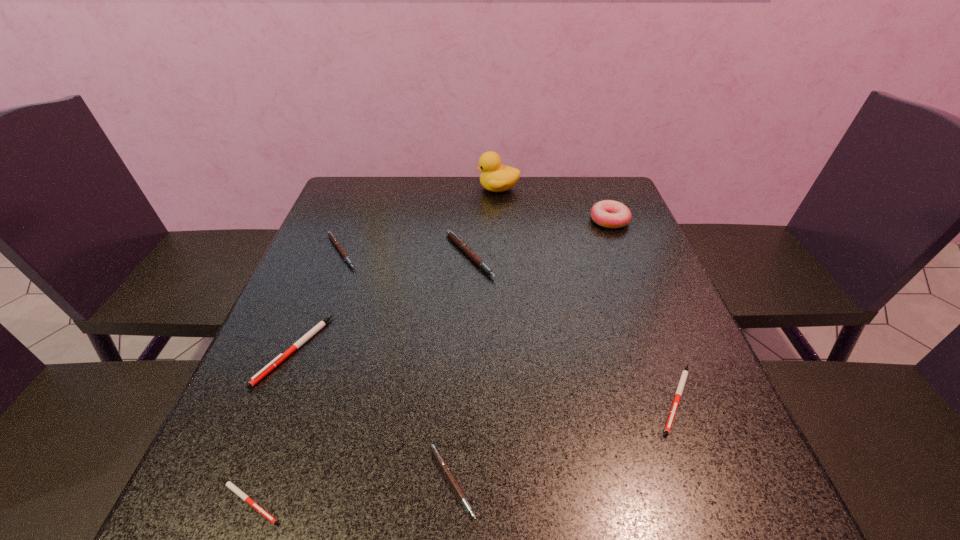
Image resolution: width=960 pixels, height=540 pixels. I want to click on vacant space in between the rightmost white pen and the biggest white pen, so click(x=486, y=374).

Image resolution: width=960 pixels, height=540 pixels. I want to click on free space that is in between the biggest white pen and the leftmost pink pen, so click(318, 301).

The width and height of the screenshot is (960, 540). In order to click on blank region between the seventh shortest object and the tallest object in this screenshot , I will do `click(554, 204)`.

Where is `the sixth closest object to the duck`? the sixth closest object to the duck is located at coordinates (439, 458).

Locate which object ranks sixth in proximity to the leftmost pink pen. Please provide its 2D coordinates. Your answer should be formatted as a tuple, i.e. [(x, y)], where the tuple contains the x and y coordinates of a point satisfying the conditions above.

[(607, 213)]

This screenshot has width=960, height=540. I want to click on pen that stands as the fourth closest to the second tallest object, so click(439, 458).

Select which pen is the second closest to the second biggest pink pen. Please provide its 2D coordinates. Your answer should be formatted as a tuple, i.e. [(x, y)], where the tuple contains the x and y coordinates of a point satisfying the conditions above.

[(460, 243)]

Locate which pink pen is the closest to the biggest white pen. Please provide its 2D coordinates. Your answer should be formatted as a tuple, i.e. [(x, y)], where the tuple contains the x and y coordinates of a point satisfying the conditions above.

[(333, 238)]

The width and height of the screenshot is (960, 540). Identify the location of pink pen that is the second closest to the biggest pink pen. (439, 458).

Identify which white pen is the nearest to the second biggest white pen. Please provide its 2D coordinates. Your answer should be formatted as a tuple, i.e. [(x, y)], where the tuple contains the x and y coordinates of a point satisfying the conditions above.

[(230, 485)]